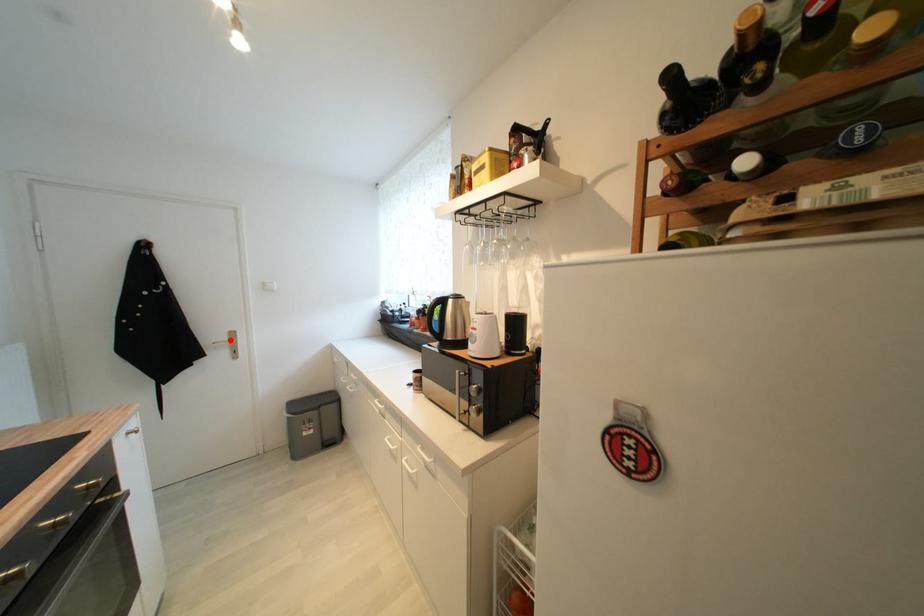
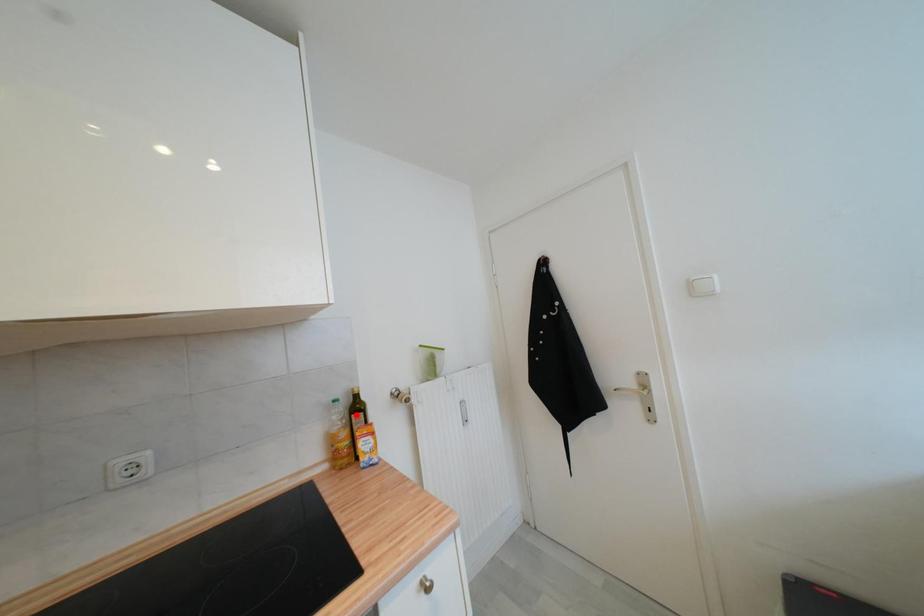
I am providing you with two images of the same scene from different viewpoints. A red point is marked on the first image and another point is marked on the second image. Is the red point in image1 aligned with the point shown in image2?

No